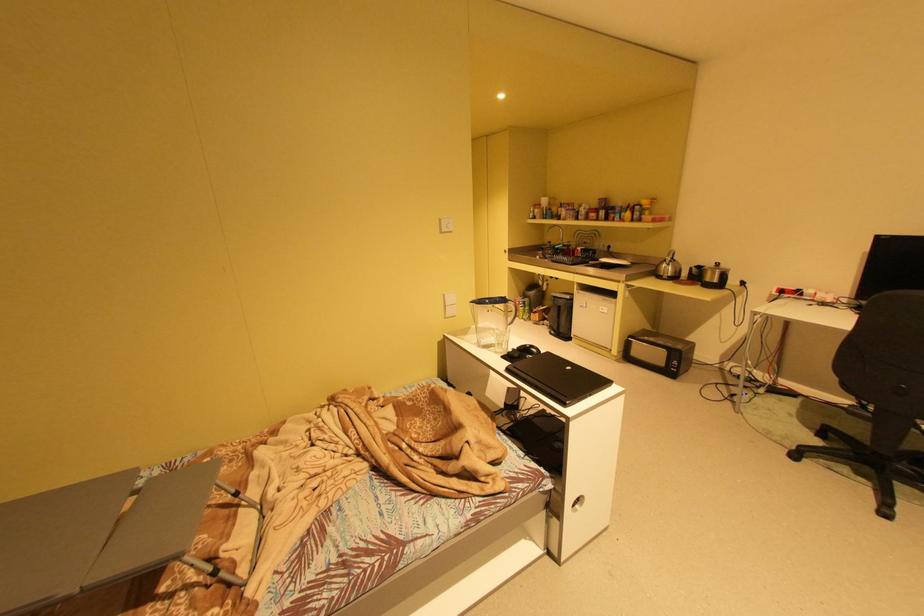
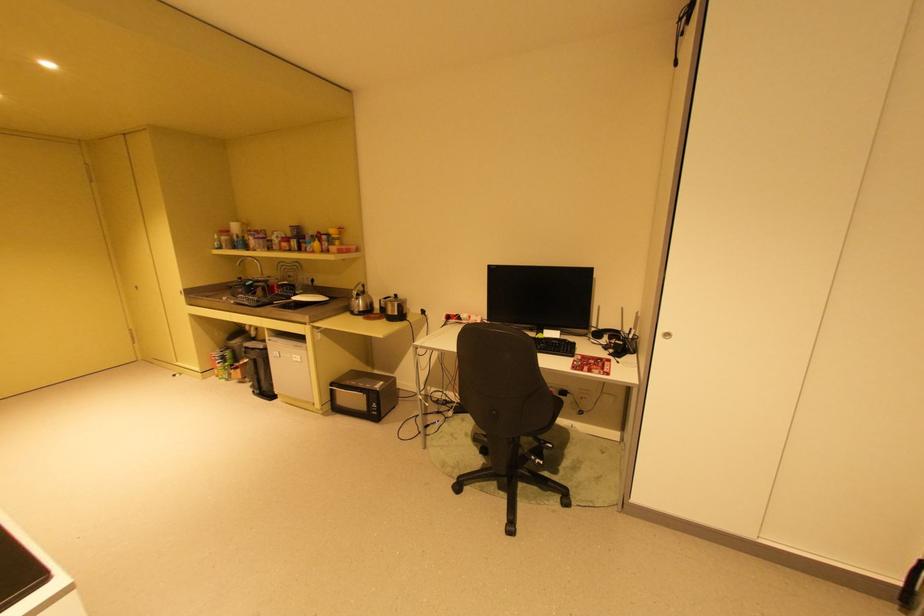
In the second image, find the point that corresponds to (613,261) in the first image.

(304, 299)